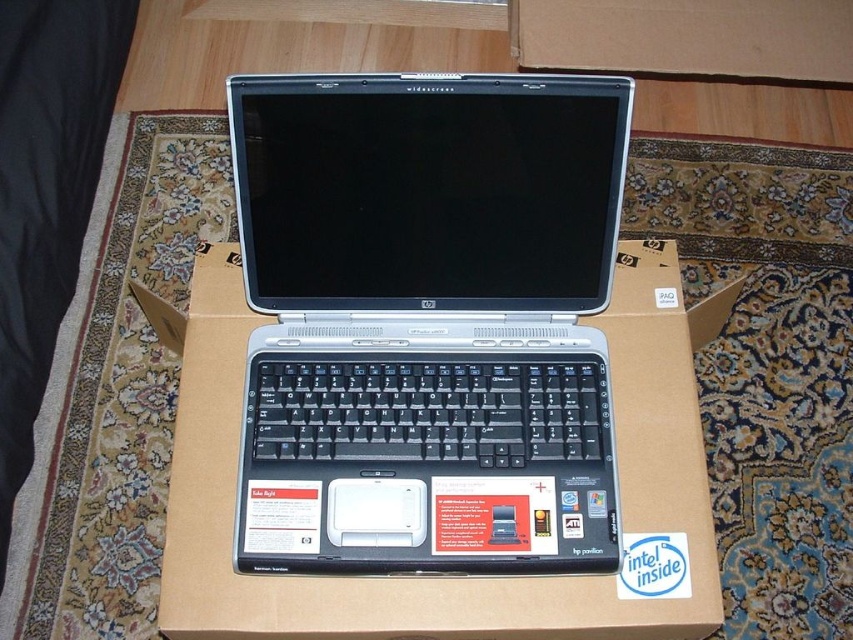
From the picture: You are setting up a new laptop and need to place the keyboard on the cardboard box. Based on the image, is the cardboard at center currently positioned below the black plastic keyboard at center?

Yes, the cardboard at center is positioned below the black plastic keyboard at center, so placing the keyboard there would be possible.